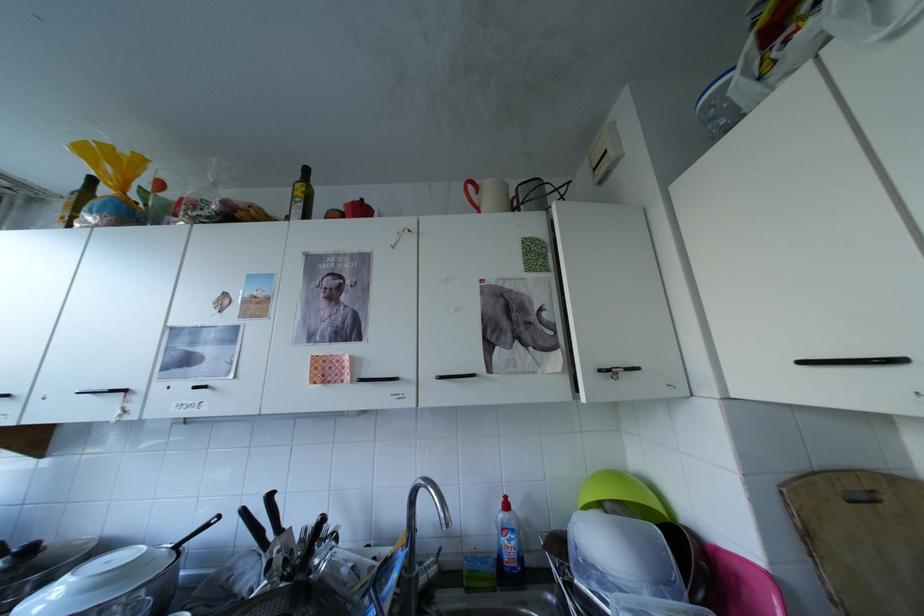
In order to click on silver faucet lever in this screenshot , I will do `click(423, 514)`.